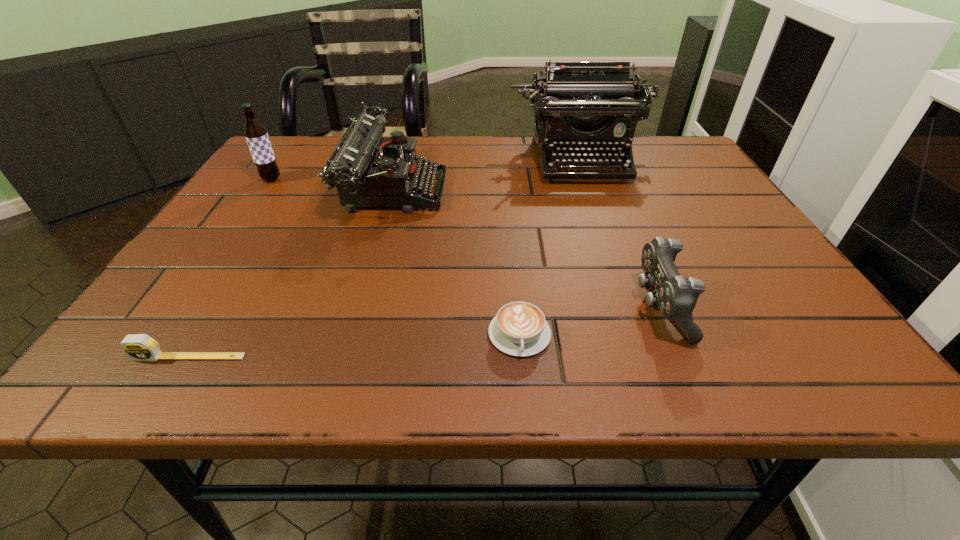
You are a GUI agent. You are given a task and a screenshot of the screen. Output one action in this format:
    pyautogui.click(x=<x>, y=<y>)
    Task: Click on the object that is at the right edge
    The width and height of the screenshot is (960, 540).
    Given the screenshot: What is the action you would take?
    pyautogui.click(x=594, y=106)

Where is `object that is at the far left corner`? object that is at the far left corner is located at coordinates (255, 133).

Find the location of a particular element. object that is positioned at the near left corner is located at coordinates (139, 347).

You are a GUI agent. You are given a task and a screenshot of the screen. Output one action in this format:
    pyautogui.click(x=<x>, y=<y>)
    Task: Click on the object present at the far right corner
    The image size is (960, 540).
    Given the screenshot: What is the action you would take?
    pyautogui.click(x=594, y=106)

Identify the location of blank area at the far edge. (481, 165).

In the image, there is a desktop. Where is `free space at the near edge`? free space at the near edge is located at coordinates (634, 351).

What are the coordinates of `vacant area at the left edge of the desktop` in the screenshot? It's located at (149, 304).

The height and width of the screenshot is (540, 960). Identify the location of vacant area at the right edge of the desktop. (666, 201).

The image size is (960, 540). In the image, there is a desktop. Find the location of `free space at the far left corner`. free space at the far left corner is located at coordinates (315, 143).

What are the coordinates of `vacant space at the near left corner of the desktop` in the screenshot? It's located at (178, 374).